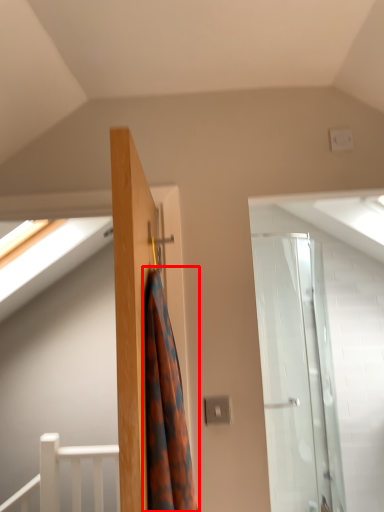
Question: From the image's perspective, what is the correct spatial positioning of shower curtain (annotated by the red box) in reference to rail?

Choices:
 (A) above
 (B) below

Answer: (A)